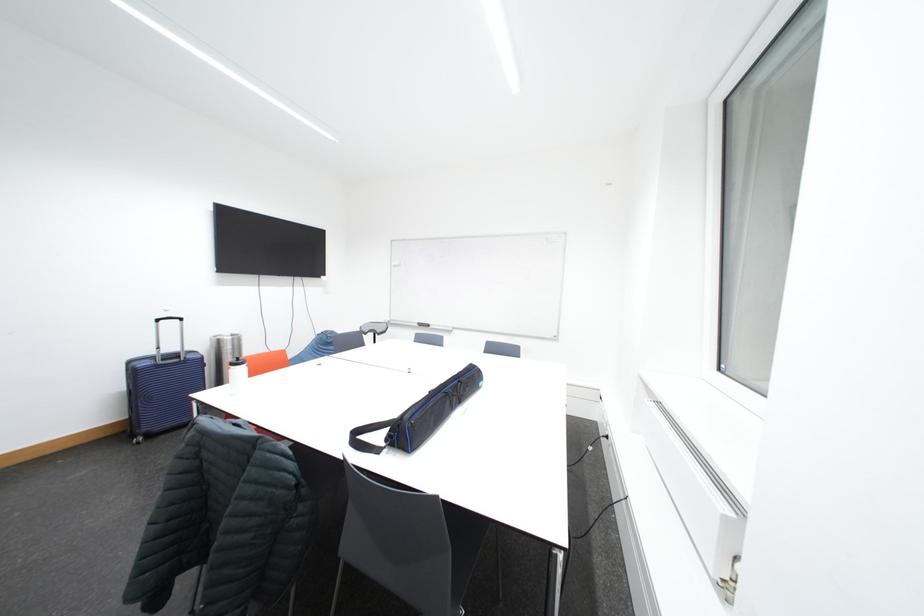
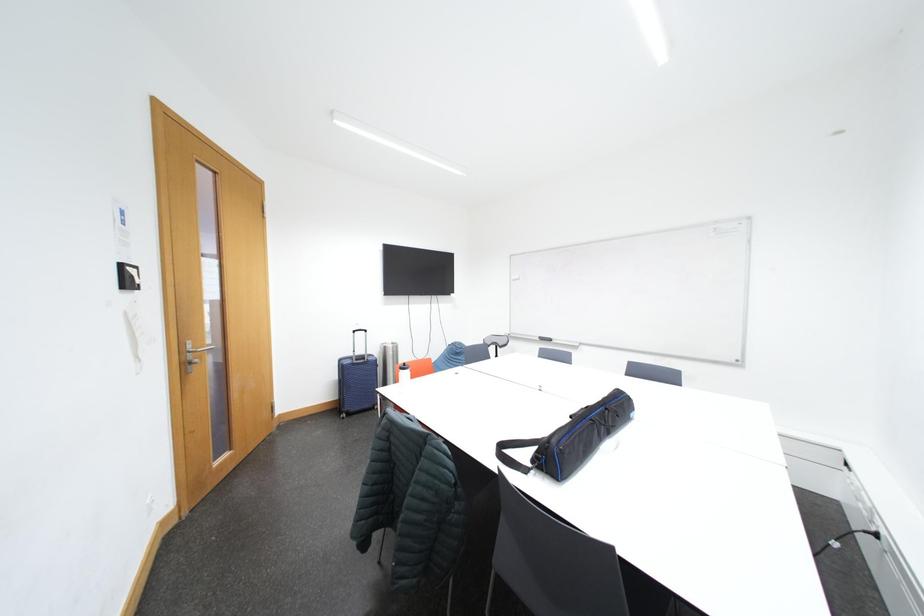
Question: What movement of the cameraman would produce the second image?

Choices:
 (A) Left
 (B) Right
 (C) Forward
 (D) Backward

Answer: (A)